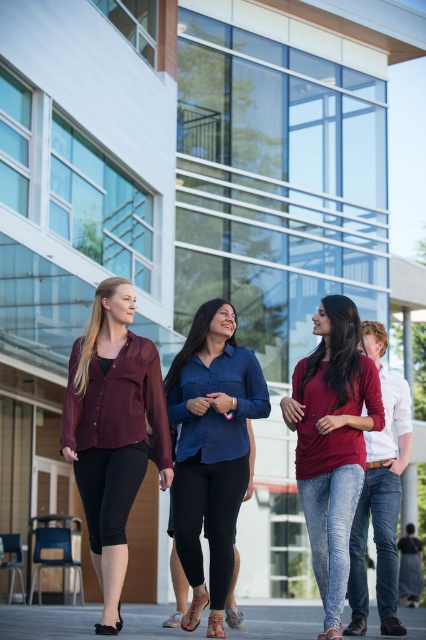
You are a fashion designer observing the group of four individuals walking in front of the modern building. You notice the matte burgundy blouse at center and the matte red shirt at center. Which one has a higher neckline?

The matte burgundy blouse at center is taller than the matte red shirt at center, so it has a higher neckline.

You are standing at the camera position and want to hand a document to the person wearing the matte burgundy blouse at center. Considering the distance, do you need to walk towards them to deliver it?

The matte burgundy blouse at center is 37.92 feet away from the camera, so you need to walk towards them to deliver the document as the distance is too far to reach without moving.

You are a photographer who needs to take a photo of the group. You are currently holding a camera and standing 40.67 feet away from the navy blue shirt at center. Can you capture the entire group in one shot without moving? Explain your reasoning.

The camera is 40.67 feet away from the navy blue shirt at center. Since the group is walking together in front of the building and the distance is fixed, it depends on the camera lens. A wide angle lens could potentially capture the entire group at that distance, but a standard lens might require moving closer. Without knowing the camera specifications, it is uncertain. However, the question states not to assume beyond given info. The answer must be based on the provided distance. Since the objects are 40.6